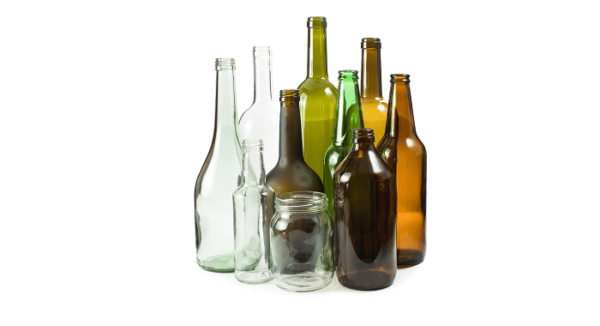
You are a GUI agent. You are given a task and a screenshot of the screen. Output one action in this format:
    pyautogui.click(x=<x>, y=<y>)
    Task: Click on the bottles
    
    Given the screenshot: What is the action you would take?
    pyautogui.click(x=250, y=153), pyautogui.click(x=225, y=141), pyautogui.click(x=262, y=110), pyautogui.click(x=287, y=120), pyautogui.click(x=310, y=90), pyautogui.click(x=352, y=94), pyautogui.click(x=368, y=88), pyautogui.click(x=408, y=119), pyautogui.click(x=364, y=192)